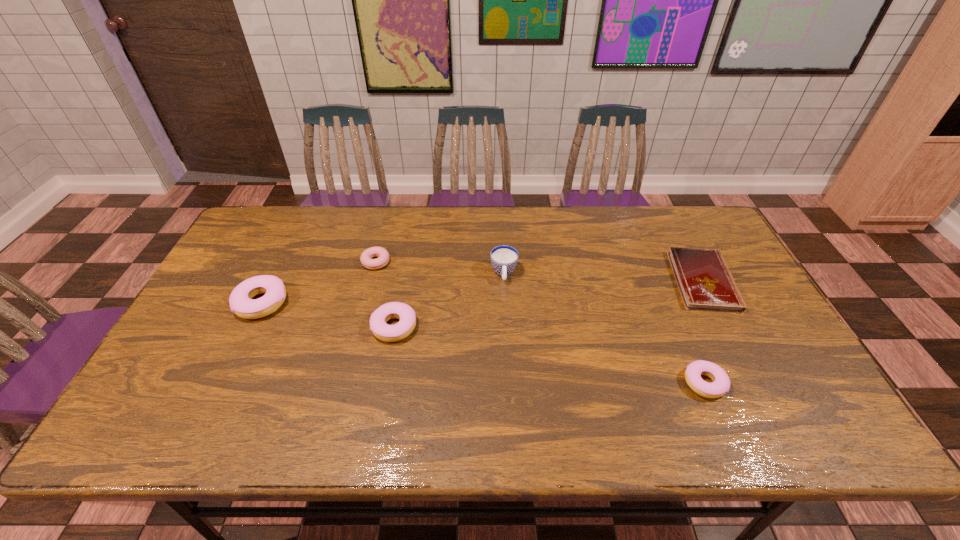
Identify the location of free location at the left edge. (180, 365).

The width and height of the screenshot is (960, 540). In the image, there is a desktop. Find the location of `vacant region at the far left corner`. vacant region at the far left corner is located at coordinates (271, 213).

Identify the location of vacant position at the far right corner of the desktop. The height and width of the screenshot is (540, 960). (710, 233).

Where is `unoccupied position between the nearest object and the farthest doughnut`? The height and width of the screenshot is (540, 960). unoccupied position between the nearest object and the farthest doughnut is located at coordinates (540, 322).

You are a GUI agent. You are given a task and a screenshot of the screen. Output one action in this format:
    pyautogui.click(x=<x>, y=<y>)
    Task: Click on the vacant area that lies between the third shortest doughnut and the nearest object
    The image size is (960, 540).
    Given the screenshot: What is the action you would take?
    pyautogui.click(x=549, y=355)

Locate an element on the screen. This screenshot has height=540, width=960. vacant area that lies between the rightmost doughnut and the notebook is located at coordinates (704, 332).

In order to click on free space between the notebook and the second tallest object in this screenshot , I will do `click(483, 292)`.

Image resolution: width=960 pixels, height=540 pixels. In order to click on free space between the shortest object and the tallest doughnut in this screenshot , I will do `click(483, 292)`.

I want to click on vacant space that's between the notebook and the rightmost doughnut, so click(704, 332).

I want to click on vacant region between the nearest object and the notebook, so click(x=704, y=332).